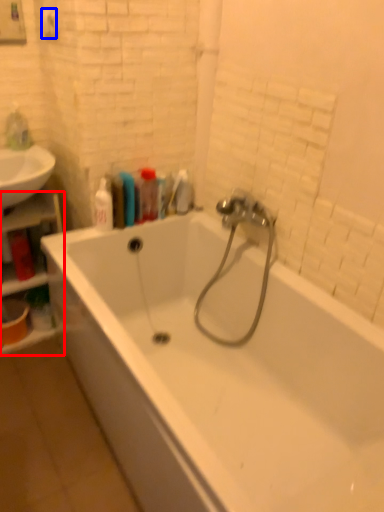
Question: Which object appears closest to the camera in this image, shelf (highlighted by a red box) or towel bar (highlighted by a blue box)?

Choices:
 (A) shelf
 (B) towel bar

Answer: (B)